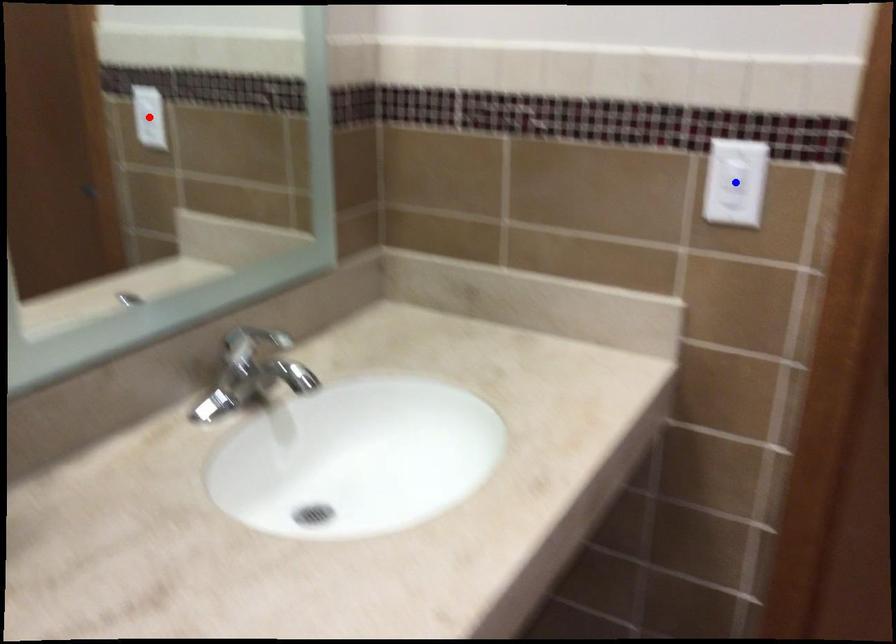
Question: In the image, two points are highlighted. Which point is nearer to the camera? Reply with the corresponding letter.

Choices:
 (A) blue point
 (B) red point

Answer: (A)